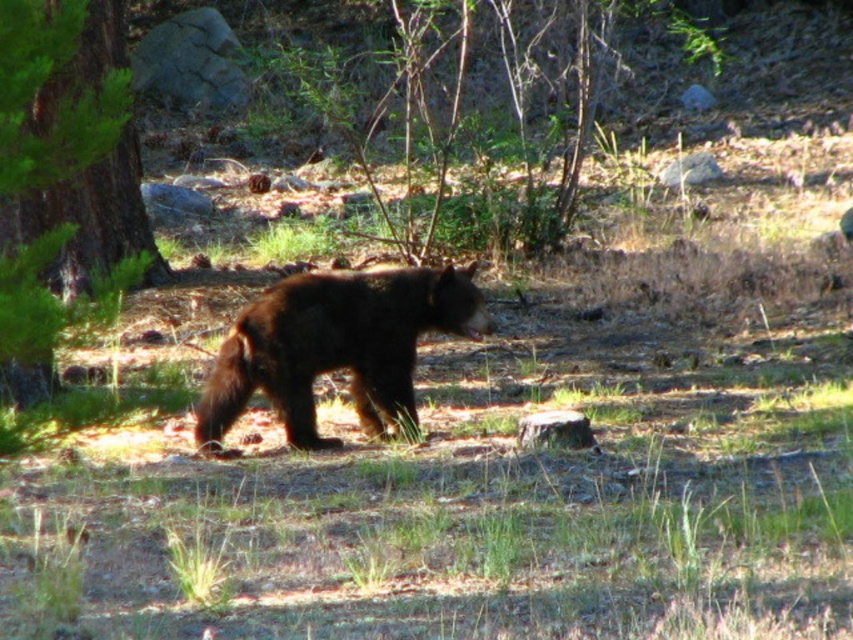
You are a hiker who just spotted the shiny dark brown bear at center. The bear is 25.50 feet away from you. If your camera has a maximum zoom range of 20 feet, can you take a clear photo of the bear without moving closer?

The shiny dark brown bear at center is 25.50 feet away, which exceeds the camera maximum zoom range of 20 feet. Therefore, you cannot take a clear photo of the shiny dark brown bear at center without moving closer.

You are a hiker who wants to take a photo of the shiny dark brown bear at center and the green leafy tree at left. Which one is wider in the image?

The shiny dark brown bear at center is wider than the green leafy tree at left.

A hiker is standing at the point labeled point [351,349] and wants to reach a cabin located 8 meters away in a straight line. The forest has dense vegetation that might block the path. Can the hiker walk directly to the cabin without obstacles?

The hiker can walk directly to the cabin since the distance between the point labeled point [351,349] and the cabin is exactly 8.00 meters, and there are no trees or other obstacles mentioned in the scene description to block the path.